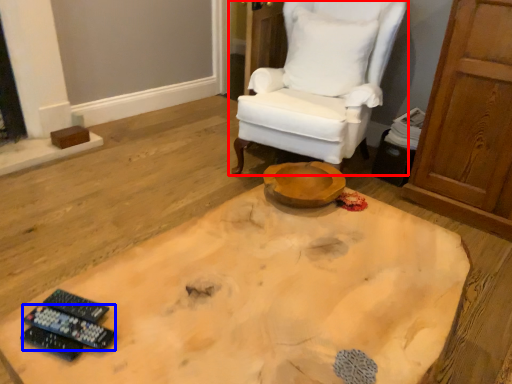
Question: Which object appears closest to the camera in this image, chair (highlighted by a red box) or remote control (highlighted by a blue box)?

Choices:
 (A) chair
 (B) remote control

Answer: (B)